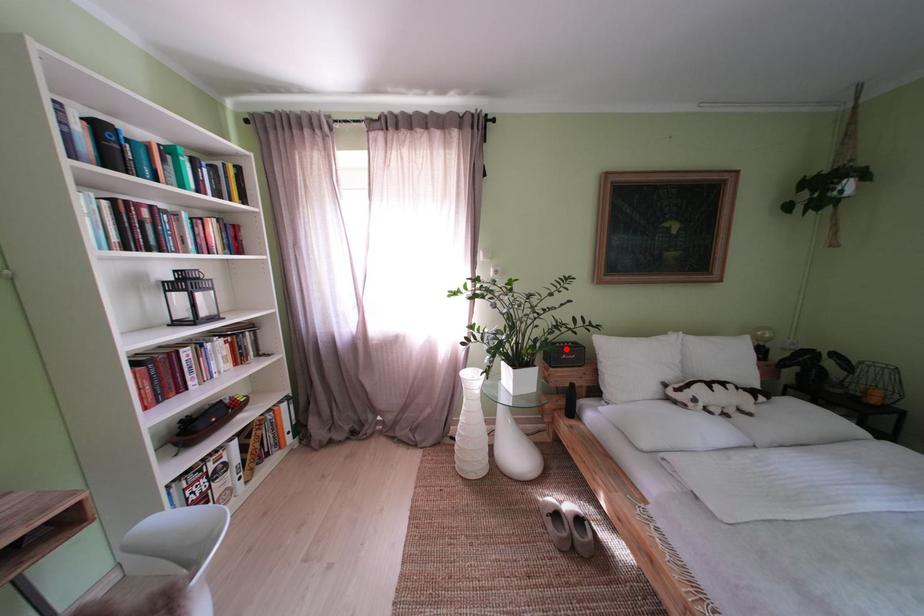
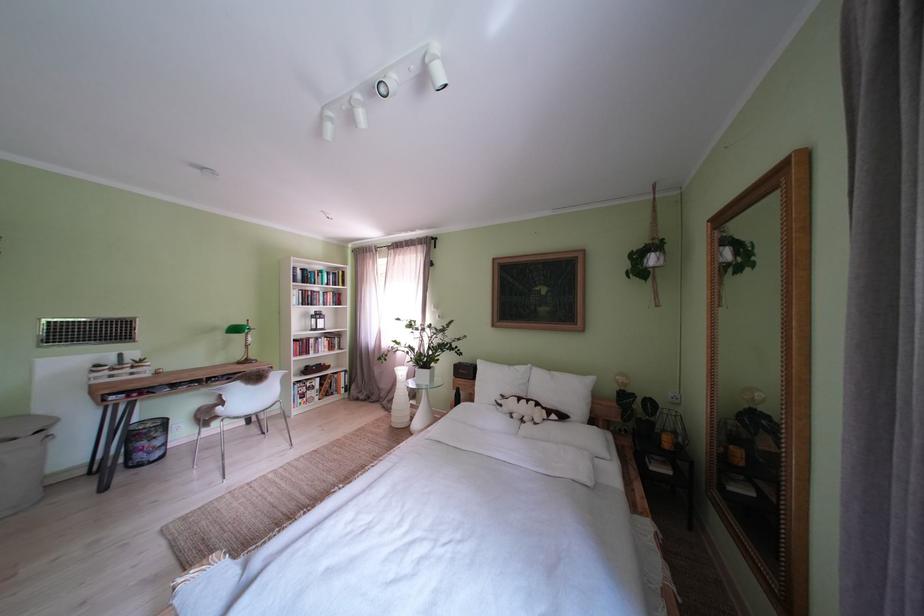
Question: I am providing you with two images of the same scene from different viewpoints. A red point is marked on the first image. Can you still see the location of the red point in image 2?

Choices:
 (A) Yes
 (B) No

Answer: (A)